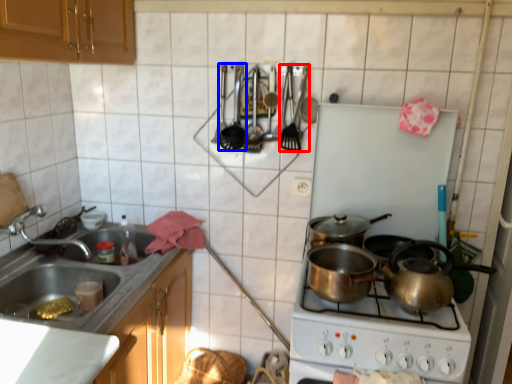
Question: Which object appears farthest to the camera in this image, silverware (highlighted by a red box) or appliance (highlighted by a blue box)?

Choices:
 (A) silverware
 (B) appliance

Answer: (B)